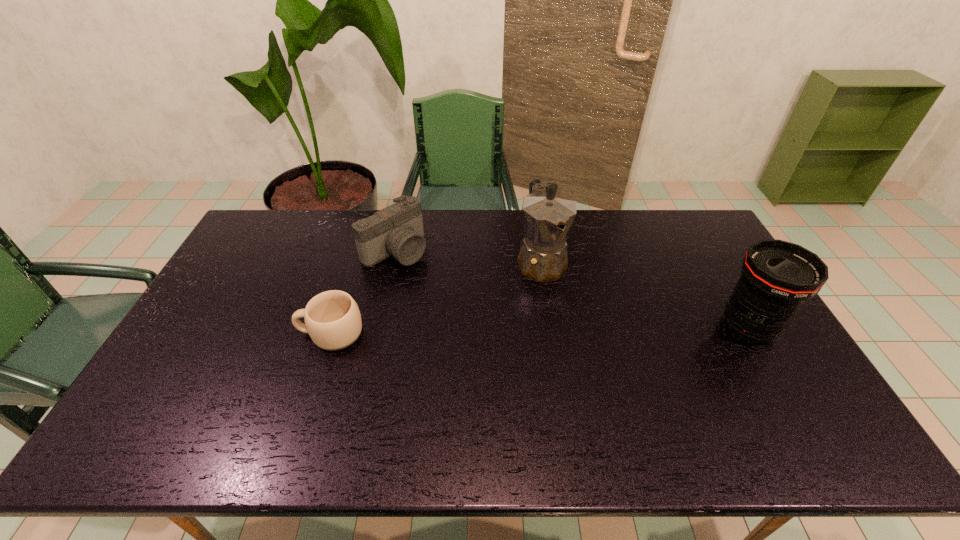
In order to click on vacant space that's between the telephoto lens and the second shortest object in this screenshot , I will do `click(572, 288)`.

This screenshot has height=540, width=960. What are the coordinates of `blank region between the rightmost object and the tallest object` in the screenshot? It's located at (645, 294).

This screenshot has width=960, height=540. In order to click on free space between the telephoto lens and the coffeepot in this screenshot , I will do `click(645, 294)`.

Locate an element on the screen. vacant space that's between the shortest object and the telephoto lens is located at coordinates (540, 330).

This screenshot has width=960, height=540. What are the coordinates of `vacant area between the second shortest object and the third object from left to right` in the screenshot? It's located at (468, 256).

This screenshot has height=540, width=960. In order to click on object that stands as the closest to the mug in this screenshot , I will do `click(397, 230)`.

The width and height of the screenshot is (960, 540). I want to click on object that is the second closest one to the second object from right to left, so click(777, 277).